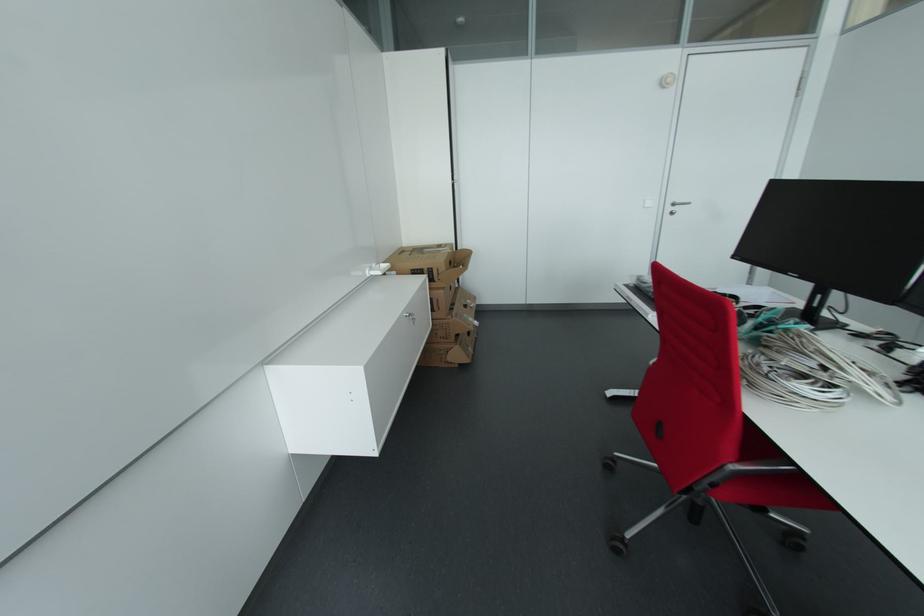
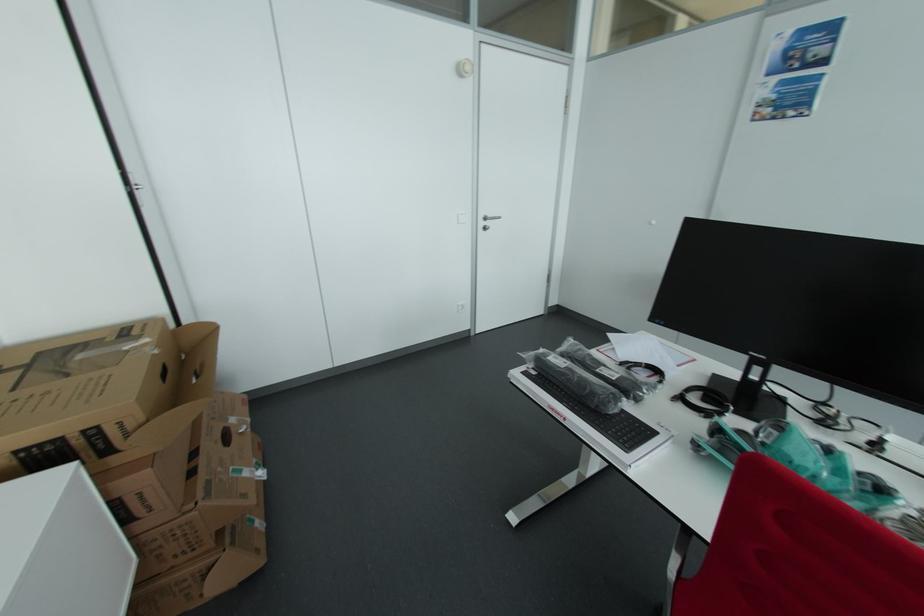
Locate, in the second image, the point that corresponds to the point at 475,307 in the first image.

(245, 432)